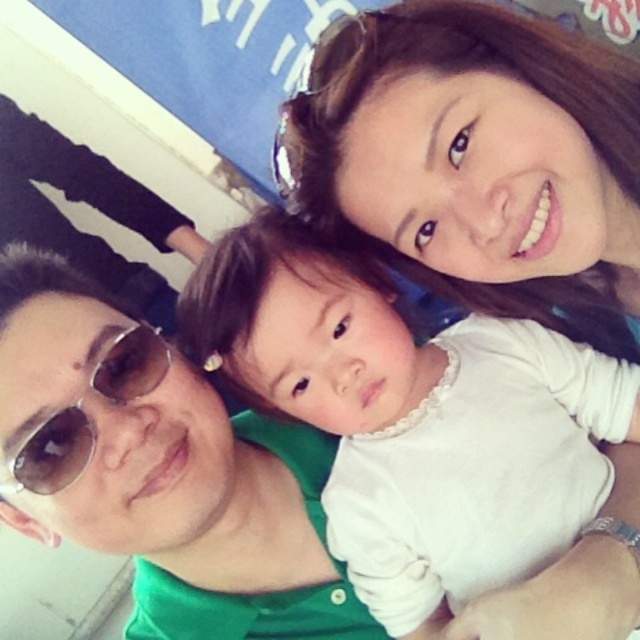
Who is positioned more to the right, sunglasses at left or brown reflective sunglasses at left?

brown reflective sunglasses at left is more to the right.

Who is shorter, sunglasses at left or brown reflective sunglasses at left?

brown reflective sunglasses at left is shorter.

Where is `sunglasses at left`? sunglasses at left is located at coordinates (92, 205).

You are a GUI agent. You are given a task and a screenshot of the screen. Output one action in this format:
    pyautogui.click(x=<x>, y=<y>)
    Task: Click on the sunglasses at left
    The height and width of the screenshot is (640, 640).
    Given the screenshot: What is the action you would take?
    pyautogui.click(x=92, y=205)

Between white soft fabric at center and brown reflective sunglasses at left, which one is positioned lower?

white soft fabric at center is lower down.

What do you see at coordinates (413, 419) in the screenshot? This screenshot has width=640, height=640. I see `white soft fabric at center` at bounding box center [413, 419].

The image size is (640, 640). Identify the location of white soft fabric at center. (413, 419).

Looking at this image, which is above, white soft fabric at center or sunglasses at left?

sunglasses at left is above.

Can you confirm if white soft fabric at center is smaller than sunglasses at left?

No, white soft fabric at center is not smaller than sunglasses at left.

Who is more forward, (528, 406) or (3, 212)?

Positioned in front is point (528, 406).

Locate an element on the screen. white soft fabric at center is located at coordinates (413, 419).